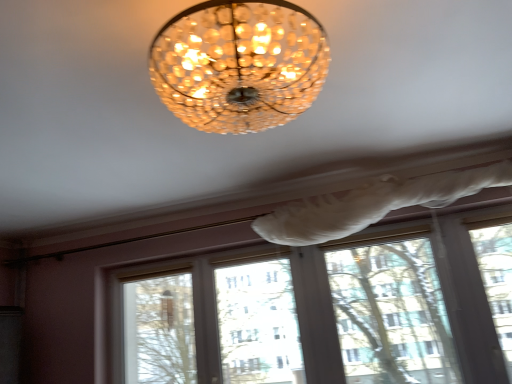
Question: From their relative heights in the image, would you say matte glass chandelier at center is taller or shorter than white plastic window frame at lower right?

Choices:
 (A) tall
 (B) short

Answer: (B)

Question: From the image's perspective, is matte glass chandelier at center above or below white plastic window frame at lower right?

Choices:
 (A) above
 (B) below

Answer: (A)

Question: Is point (228, 52) positioned closer to the camera than point (424, 302)?

Choices:
 (A) farther
 (B) closer

Answer: (B)

Question: In terms of width, does white plastic window frame at lower right look wider or thinner when compared to matte glass chandelier at center?

Choices:
 (A) wide
 (B) thin

Answer: (B)

Question: From a real-world perspective, is white plastic window frame at lower right above or below matte glass chandelier at center?

Choices:
 (A) below
 (B) above

Answer: (A)

Question: Is white plastic window frame at lower right inside or outside of matte glass chandelier at center?

Choices:
 (A) inside
 (B) outside

Answer: (B)

Question: Is white plastic window frame at lower right in front of or behind matte glass chandelier at center in the image?

Choices:
 (A) behind
 (B) front

Answer: (A)